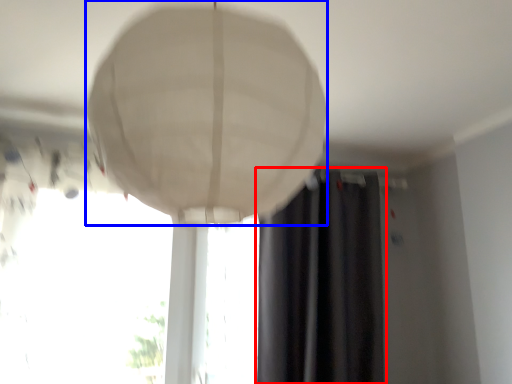
Question: Which point is further to the camera, curtain (highlighted by a red box) or lamp (highlighted by a blue box)?

Choices:
 (A) curtain
 (B) lamp

Answer: (A)